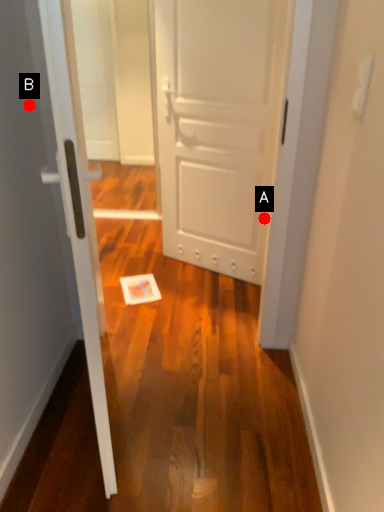
Question: Two points are circled on the image, labeled by A and B beside each circle. Among these points, which one is nearest to the camera?

Choices:
 (A) A is closer
 (B) B is closer

Answer: (B)